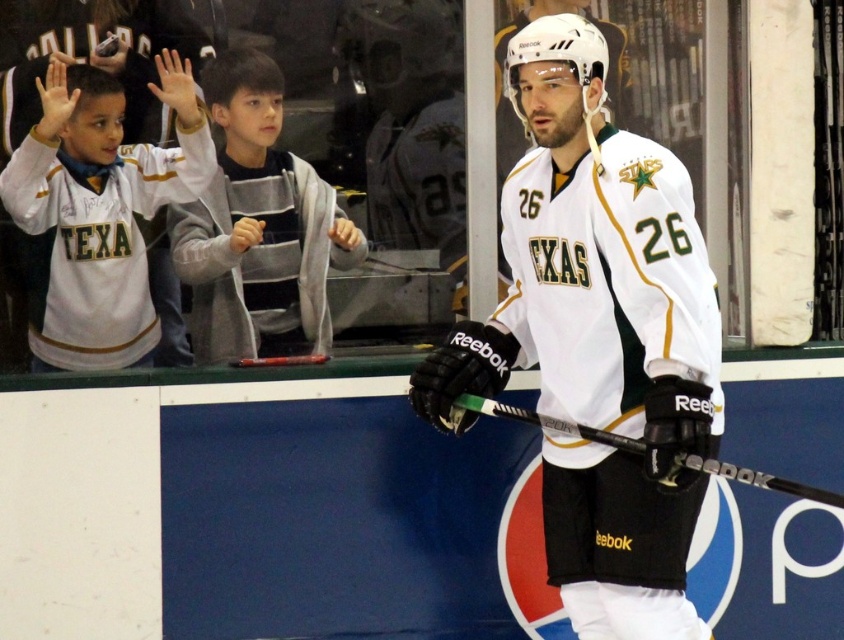
Between white matte jersey at center and gray striped sweater at upper left, which one has more height?

white matte jersey at center is taller.

Which is behind, point (606, 192) or point (184, 234)?

The point (184, 234) is behind.

Find the location of `white matte jersey at center`. white matte jersey at center is located at coordinates (598, 339).

At what (x,y) coordinates should I click in order to perform the action: click on white matte jersey at center. Please return your answer as a coordinate pair (x, y). Looking at the image, I should click on (598, 339).

Can you confirm if white jersey at upper left is thinner than black matte hockey stick at center?

Indeed, white jersey at upper left has a lesser width compared to black matte hockey stick at center.

Looking at this image, is white jersey at upper left positioned in front of black matte hockey stick at center?

No, white jersey at upper left is further to the viewer.

Who is more distant from viewer, (72, 269) or (788, 492)?

Positioned behind is point (72, 269).

What are the coordinates of `white jersey at upper left` in the screenshot? It's located at (98, 212).

Who is more distant from viewer, [206,202] or [760,484]?

Positioned behind is point [206,202].

Who is more forward, (261, 83) or (642, 449)?

Point (642, 449)

Is point (226, 76) positioned behind point (749, 468)?

No, it is in front of (749, 468).

Locate an element on the screen. Image resolution: width=844 pixels, height=640 pixels. gray striped sweater at upper left is located at coordinates (257, 227).